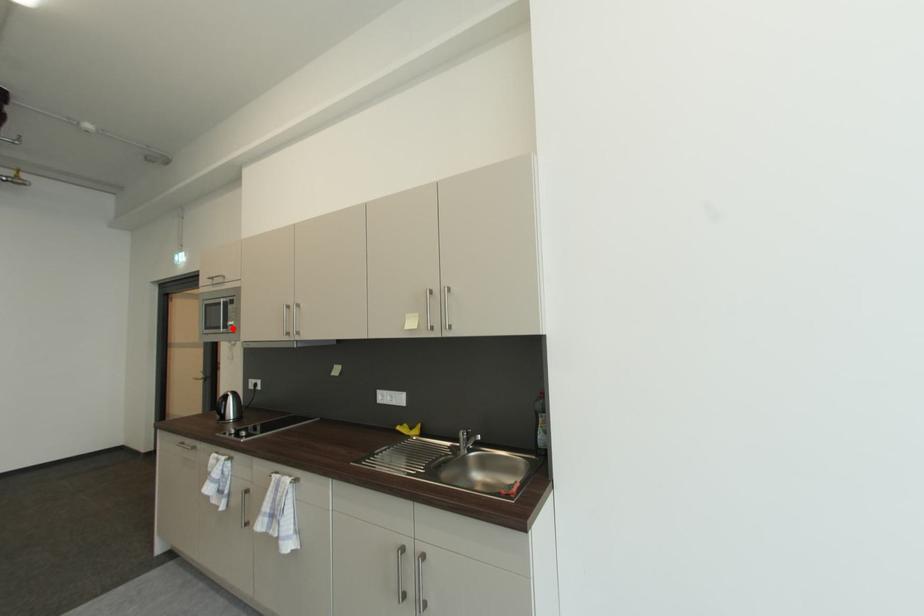
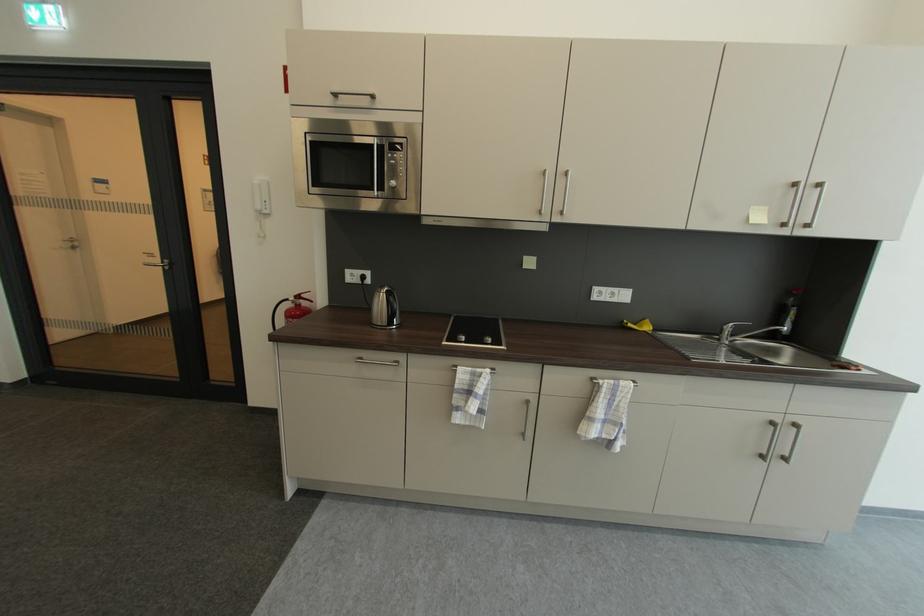
Locate, in the second image, the point that corresponds to the highlighted location in the first image.

(387, 188)